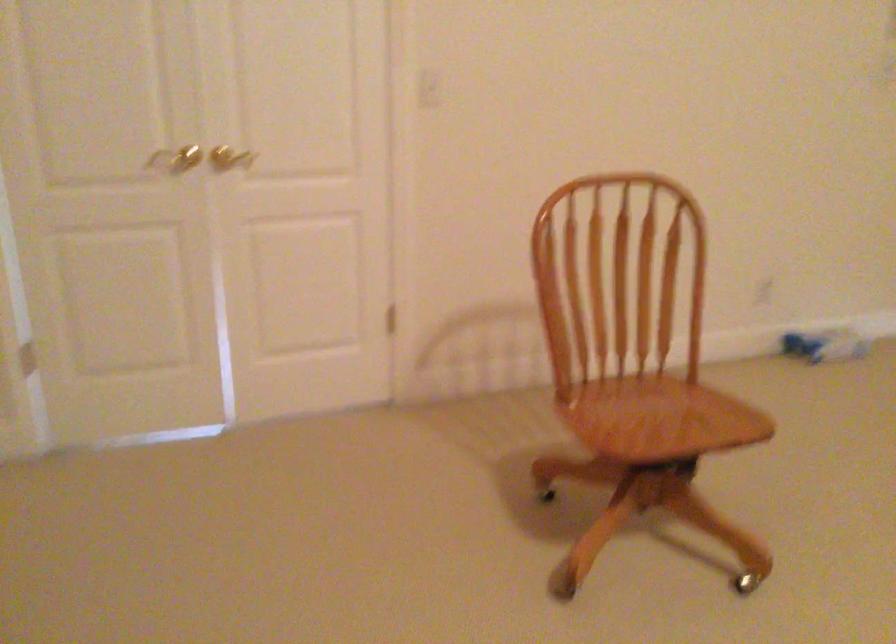
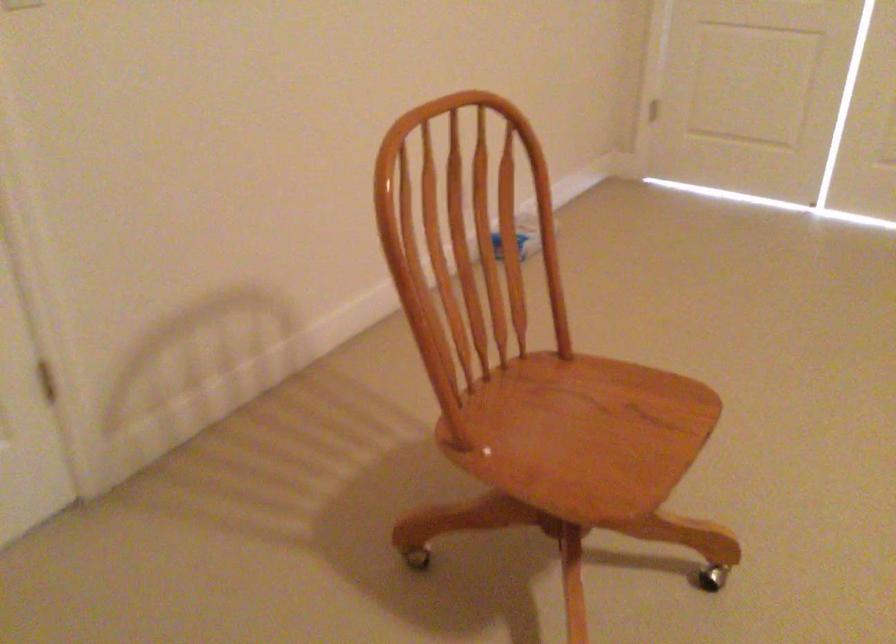
In the second image, find the point that corresponds to point 634,418 in the first image.

(565, 436)